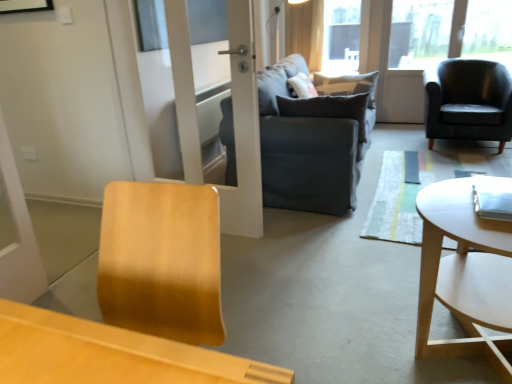
The image size is (512, 384). I want to click on free region under white wood coffee table at right (from a real-world perspective), so click(x=453, y=357).